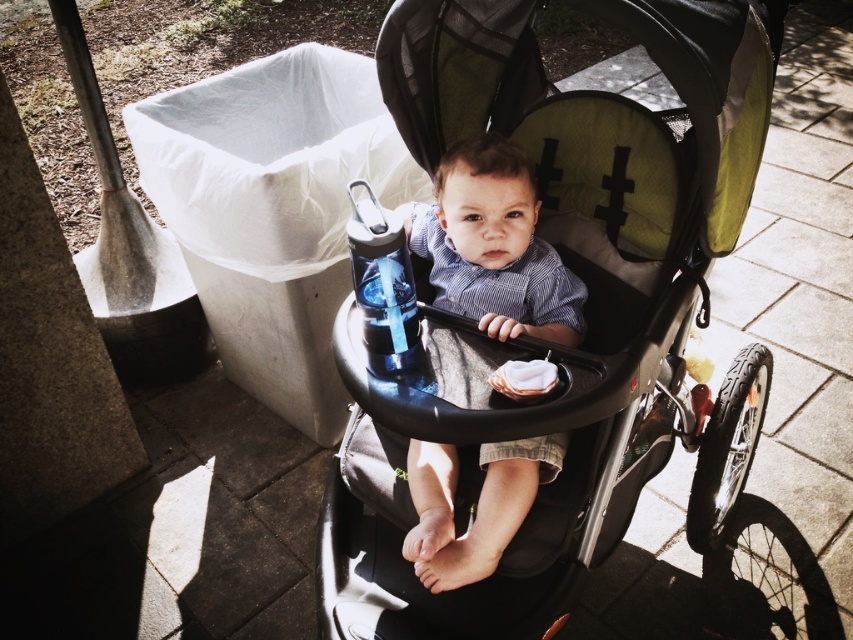
Is matte black stroller at center positioned before matte blue shirt at center?

Yes.

Which is in front, point (350, 584) or point (445, 173)?

Positioned in front is point (350, 584).

You are a GUI agent. You are given a task and a screenshot of the screen. Output one action in this format:
    pyautogui.click(x=<x>, y=<y>)
    Task: Click on the matte black stroller at center
    The image size is (853, 640).
    Given the screenshot: What is the action you would take?
    pyautogui.click(x=585, y=304)